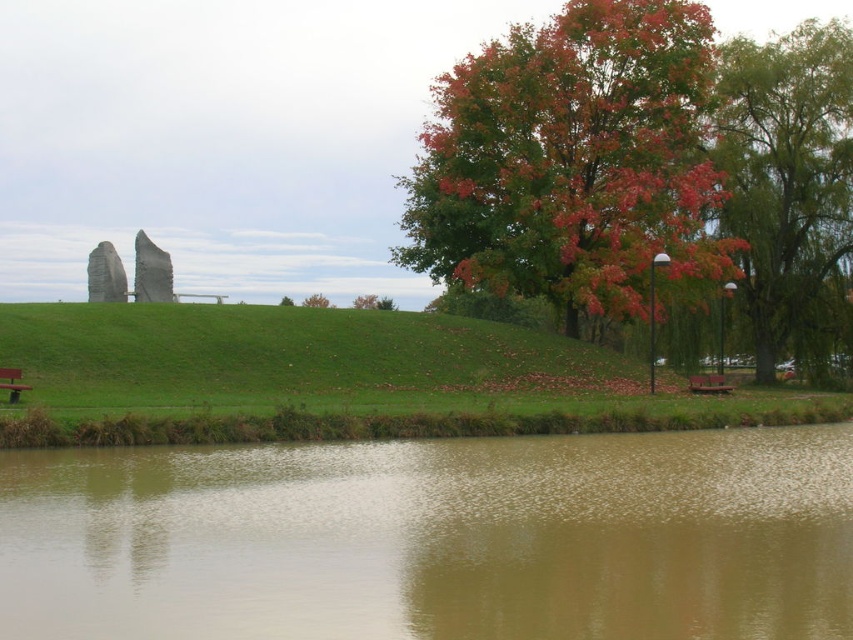
You are planning to plant a new tree between the autumn leaves tree at right and the green leafy tree at upper right. If the recommended spacing between trees is 5 meters, is there enough space for the new tree?

The distance between the autumn leaves tree at right and the green leafy tree at upper right is 6.38 meters. Since the recommended spacing is 5 meters, there is enough space to plant the new tree between them.

You are planning to plant a new tree in this outdoor area. The new tree requires a minimum of 60 feet of space between it and any existing trees to thrive. Given the current spacing between the green leafy tree at upper right and the green matte tree at center, would this area be suitable for planting the new tree?

→ The green leafy tree at upper right and the green matte tree at center are 64.13 feet apart from each other. Since the required minimum spacing is 60 feet, the existing trees already meet the requirement. Therefore, this area would be suitable for planting the new tree as long as it is placed at least 60 feet away from both existing trees.

You are standing at the base of the hill and looking towards the trees. Which tree, the autumn leaves tree at right or the green leafy tree at upper right, is positioned higher in the scene?

The autumn leaves tree at right is positioned higher in the scene than the green leafy tree at upper right.